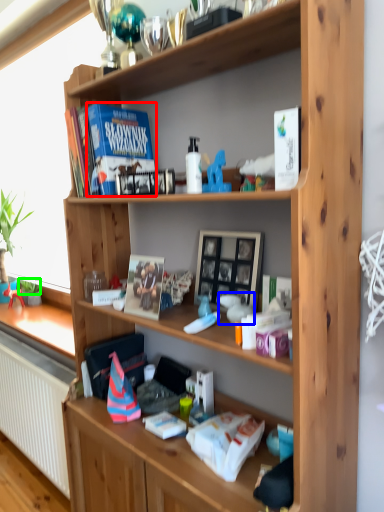
Question: Which object is the farthest from paperback book (highlighted by a red box)? Choose among these: toy (highlighted by a blue box) or plant (highlighted by a green box).

Choices:
 (A) toy
 (B) plant

Answer: (B)